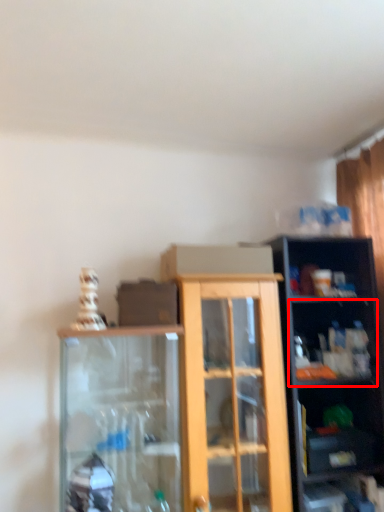
Question: Observing the image, what is the correct spatial positioning of shelf (annotated by the red box) in reference to shelf?

Choices:
 (A) right
 (B) left

Answer: (A)